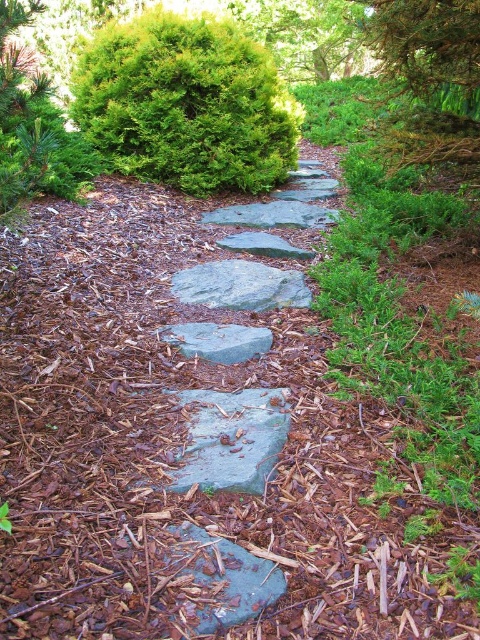
Does point (202, 304) come closer to viewer compared to point (249, 216)?

That is True.

Who is shorter, gray/rough rock at center or gray smooth stone at center?

gray/rough rock at center

Which is behind, point (269, 292) or point (255, 205)?

Point (255, 205)

Where is `gray/rough rock at center`? Image resolution: width=480 pixels, height=640 pixels. gray/rough rock at center is located at coordinates 240,285.

Can you confirm if green rough stone at center is positioned to the left of gray/rough stone at center?

Indeed, green rough stone at center is positioned on the left side of gray/rough stone at center.

Can you confirm if green rough stone at center is thinner than gray/rough stone at center?

Correct, green rough stone at center's width is less than gray/rough stone at center's.

This screenshot has width=480, height=640. Describe the element at coordinates (230, 440) in the screenshot. I see `green rough stone at center` at that location.

Identify the location of green rough stone at center. This screenshot has width=480, height=640. (230, 440).

Between point (236, 413) and point (212, 282), which one is positioned behind?

Positioned behind is point (212, 282).

Is point (204, 476) in front of point (308, 307)?

Yes.

Is point (268, 435) farther from camera compared to point (248, 282)?

No, (268, 435) is closer to viewer.

Find the location of `green rough stone at center`. green rough stone at center is located at coordinates (230, 440).